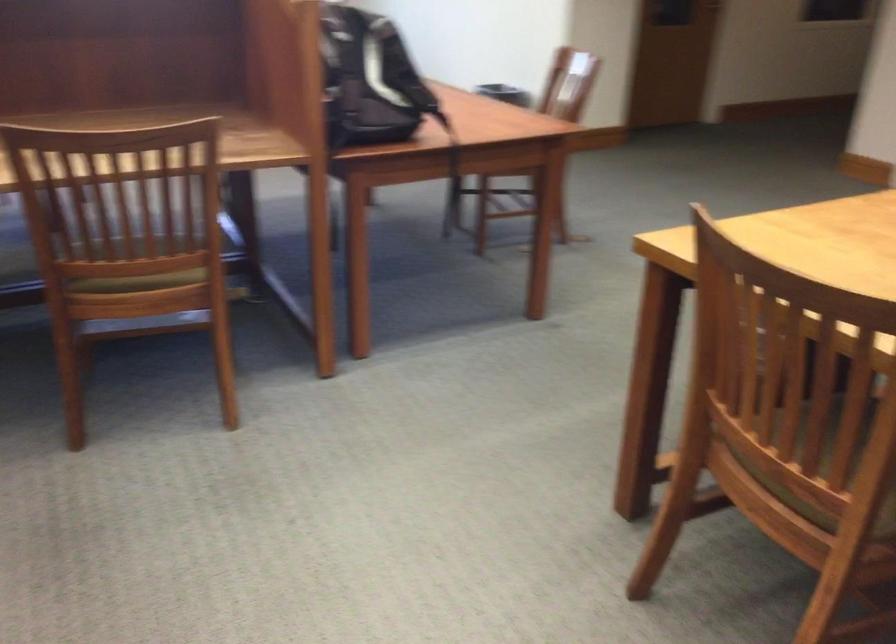
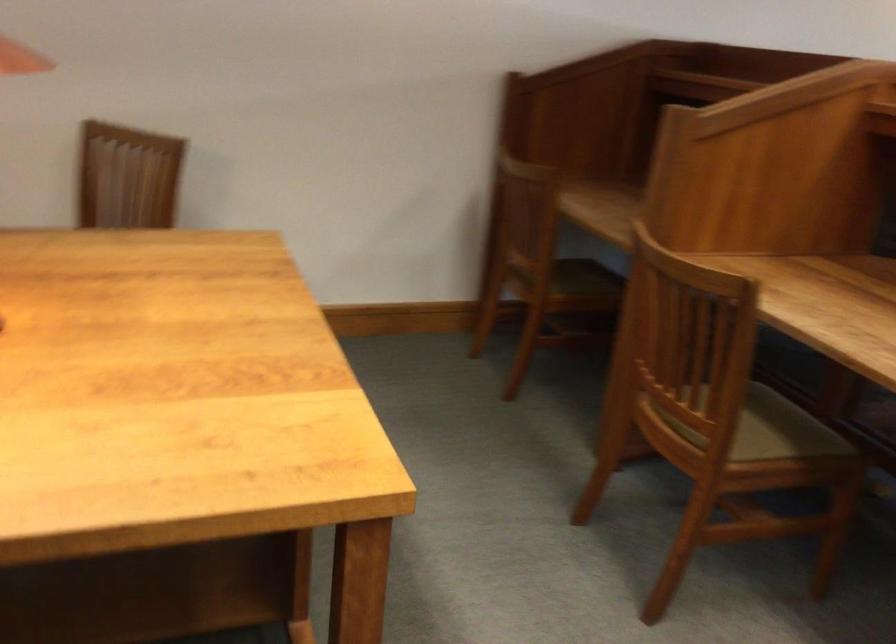
The first image is from the beginning of the video and the second image is from the end. How did the camera likely rotate when shooting the video?

The camera's rotation is toward left-down.